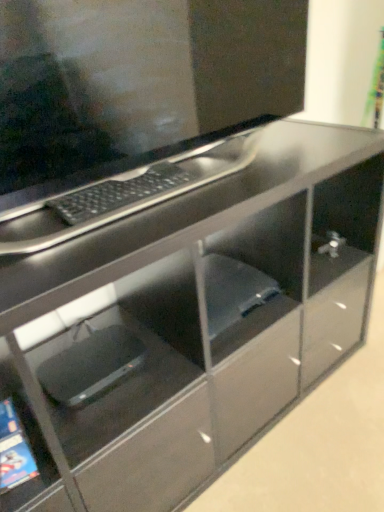
You are a GUI agent. You are given a task and a screenshot of the screen. Output one action in this format:
    pyautogui.click(x=<x>, y=<y>)
    Task: Click on the black matte keyboard at upper center
    
    Given the screenshot: What is the action you would take?
    pyautogui.click(x=123, y=194)

What is the approximate width of matte black monitor at upper center?

6.48 inches.

Find the location of a particular element. black plastic laptop at lower left is located at coordinates (91, 365).

Where is `black matte keyboard at upper center`? black matte keyboard at upper center is located at coordinates [123, 194].

Who is more distant, black matte keyboard at upper center or matte black monitor at upper center?

black matte keyboard at upper center is behind.

Is black matte keyboard at upper center thinner than matte black monitor at upper center?

Yes, black matte keyboard at upper center is thinner than matte black monitor at upper center.

Is matte black monitor at upper center at the back of black matte keyboard at upper center?

Correct, black matte keyboard at upper center is looking away from matte black monitor at upper center.

Consider the image. From the image's perspective, does black plastic laptop at lower left appear lower than matte black monitor at upper center?

Yes.

Considering the points (133, 366) and (159, 154), which point is behind, point (133, 366) or point (159, 154)?

The point (159, 154) is behind.

Measure the distance between black plastic laptop at lower left and matte black monitor at upper center.

They are 22.42 inches apart.

Is black plastic laptop at lower left to the left of matte black monitor at upper center from the viewer's perspective?

Correct, you'll find black plastic laptop at lower left to the left of matte black monitor at upper center.

Where is `computer monitor that is on the right side of black matte keyboard at upper center`? computer monitor that is on the right side of black matte keyboard at upper center is located at coordinates (136, 83).

Which point is more distant from viewer, (80, 40) or (78, 195)?

The point (78, 195) is more distant.

Is matte black monitor at upper center positioned far away from black matte keyboard at upper center?

No, matte black monitor at upper center is not far away from black matte keyboard at upper center.

Is black matte keyboard at upper center a part of matte black monitor at upper center?

That's correct, black matte keyboard at upper center is inside matte black monitor at upper center.

Measure the distance from black plastic laptop at lower left to black matte keyboard at upper center.

The distance of black plastic laptop at lower left from black matte keyboard at upper center is 14.53 inches.

Based on the photo, from the image's perspective, is black plastic laptop at lower left positioned above or below black matte keyboard at upper center?

Based on their image positions, black plastic laptop at lower left is located beneath black matte keyboard at upper center.

Which of these two, black plastic laptop at lower left or black matte keyboard at upper center, stands taller?

black plastic laptop at lower left.

Is black plastic laptop at lower left not within black matte keyboard at upper center?

black plastic laptop at lower left lies outside black matte keyboard at upper center's area.

From the image's perspective, is black matte keyboard at upper center beneath black plastic laptop at lower left?

Actually, black matte keyboard at upper center appears above black plastic laptop at lower left in the image.

Is black matte keyboard at upper center turned away from black plastic laptop at lower left?

black matte keyboard at upper center is not turned away from black plastic laptop at lower left.

Does black matte keyboard at upper center have a larger size compared to black plastic laptop at lower left?

No.

Are black matte keyboard at upper center and black plastic laptop at lower left located far from each other?

Actually, black matte keyboard at upper center and black plastic laptop at lower left are a little close together.

Can you confirm if matte black monitor at upper center is bigger than black plastic laptop at lower left?

Indeed, matte black monitor at upper center has a larger size compared to black plastic laptop at lower left.

Is matte black monitor at upper center positioned in front of black plastic laptop at lower left?

Yes, it is in front of black plastic laptop at lower left.

Is matte black monitor at upper center turned away from black plastic laptop at lower left?

No, matte black monitor at upper center's orientation is not away from black plastic laptop at lower left.

Is matte black monitor at upper center beside black plastic laptop at lower left?

No.

The image size is (384, 512). Find the location of `computer monitor on the right of black matte keyboard at upper center`. computer monitor on the right of black matte keyboard at upper center is located at coordinates (136, 83).

Find the location of a particular element. This screenshot has width=384, height=512. computer that appears below the matte black monitor at upper center (from the image's perspective) is located at coordinates (91, 365).

Based on their spatial positions, is black plastic laptop at lower left or matte black monitor at upper center further from black matte keyboard at upper center?

Among the two, black plastic laptop at lower left is located further to black matte keyboard at upper center.

From the image, which object appears to be farther from matte black monitor at upper center, black plastic laptop at lower left or black matte keyboard at upper center?

Among the two, black plastic laptop at lower left is located further to matte black monitor at upper center.

Which object lies further to the anchor point black matte keyboard at upper center, matte black monitor at upper center or black plastic laptop at lower left?

Among the two, black plastic laptop at lower left is located further to black matte keyboard at upper center.

Considering their positions, is black matte keyboard at upper center positioned further to matte black monitor at upper center than black plastic laptop at lower left?

black plastic laptop at lower left is positioned further to the anchor matte black monitor at upper center.

When comparing their distances from black plastic laptop at lower left, does matte black monitor at upper center or black matte keyboard at upper center seem further?

matte black monitor at upper center is positioned further to the anchor black plastic laptop at lower left.

Based on their spatial positions, is black matte keyboard at upper center or matte black monitor at upper center further from black plastic laptop at lower left?

Based on the image, matte black monitor at upper center appears to be further to black plastic laptop at lower left.

This screenshot has height=512, width=384. Find the location of `computer keyboard between matte black monitor at upper center and black plastic laptop at lower left in the up-down direction`. computer keyboard between matte black monitor at upper center and black plastic laptop at lower left in the up-down direction is located at coordinates (123, 194).